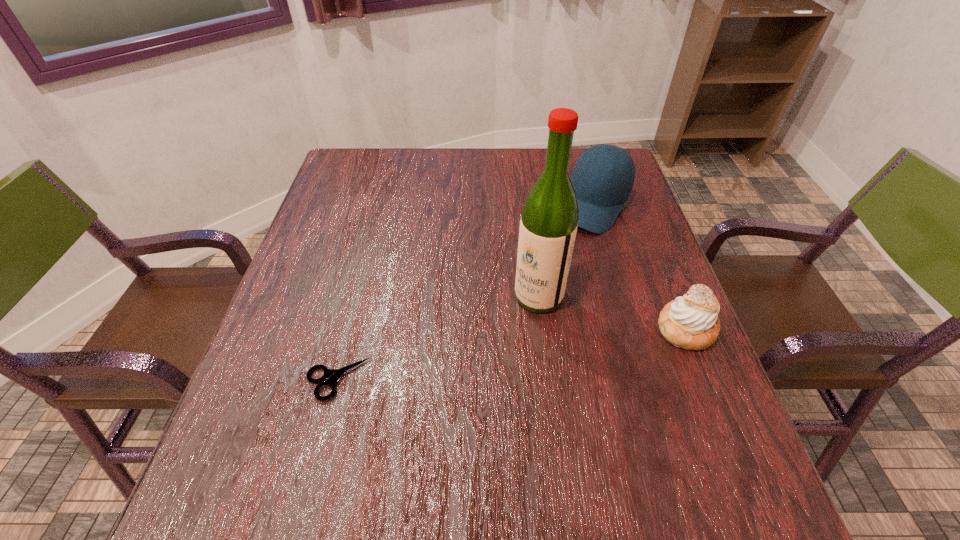
Locate an element on the screen. the shortest object is located at coordinates (332, 375).

At what (x,y) coordinates should I click in order to perform the action: click on the leftmost object. Please return your answer as a coordinate pair (x, y). Looking at the image, I should click on (332, 375).

Where is `the second shortest object`? This screenshot has height=540, width=960. the second shortest object is located at coordinates (691, 322).

Identify the location of the farthest object. (601, 191).

Locate an element on the screen. the third shortest object is located at coordinates [601, 191].

Find the location of `the third object from right to left`. the third object from right to left is located at coordinates (548, 226).

The height and width of the screenshot is (540, 960). In order to click on the tallest object in this screenshot , I will do `click(548, 226)`.

Locate an element on the screen. Image resolution: width=960 pixels, height=540 pixels. vacant area situated on the front of the shears is located at coordinates click(x=324, y=428).

This screenshot has width=960, height=540. In order to click on free location located on the left of the pastry in this screenshot , I will do `click(614, 328)`.

Find the location of a particular element. free space located on the front-facing side of the farthest object is located at coordinates (523, 319).